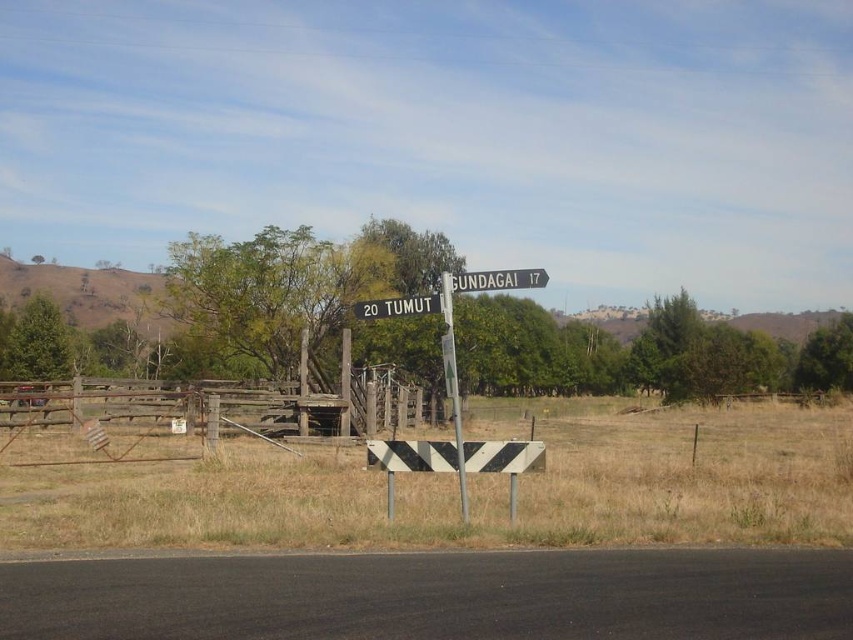
Question: Which of these objects is positioned closest to the black plastic sign at center?

Choices:
 (A) metallic pole at center
 (B) white plastic road sign at upper center

Answer: (B)

Question: Considering the relative positions of brown wooden fence at center and metallic pole at center in the image provided, where is brown wooden fence at center located with respect to metallic pole at center?

Choices:
 (A) left
 (B) right

Answer: (A)

Question: Is white plastic road sign at upper center in front of black plastic sign at center?

Choices:
 (A) yes
 (B) no

Answer: (B)

Question: Which object is the farthest from the metallic pole at center?

Choices:
 (A) white plastic road sign at upper center
 (B) black plastic sign at center

Answer: (A)

Question: Observing the image, what is the correct spatial positioning of brown wooden fence at center in reference to black plastic sign at center?

Choices:
 (A) below
 (B) above

Answer: (A)

Question: Which point is closer to the camera?

Choices:
 (A) (26, 445)
 (B) (450, 378)
 (C) (422, 300)
 (D) (479, 285)

Answer: (B)